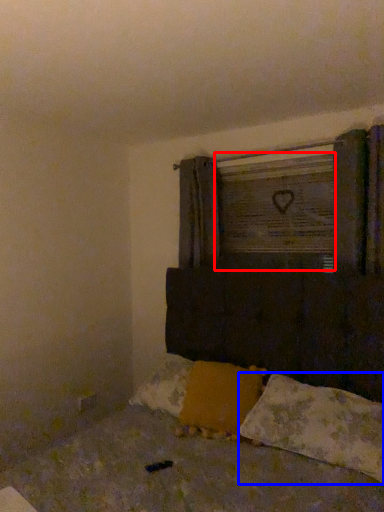
Question: Which object appears farthest to the camera in this image, window frame (highlighted by a red box) or pillow (highlighted by a blue box)?

Choices:
 (A) window frame
 (B) pillow

Answer: (A)